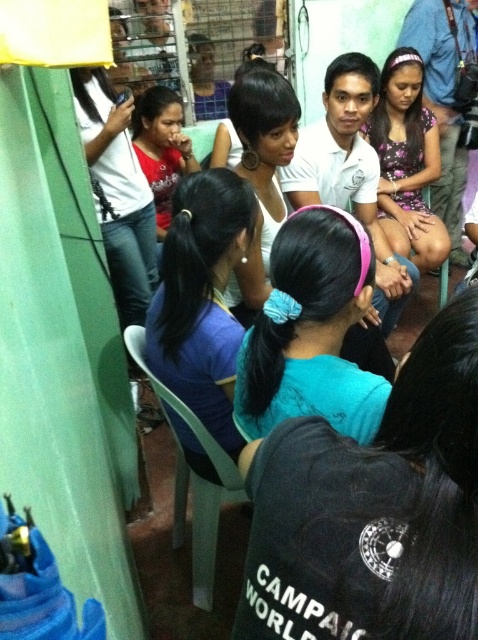
In the scene shown: Who is lower down, floral-patterned dress at center or white matte headband at center?

white matte headband at center is below.

Is floral-patterned dress at center further to the viewer compared to white matte headband at center?

Yes, it is behind white matte headband at center.

Identify the location of floral-patterned dress at center. (406, 161).

Does blue fabric shirt at center appear over white matte headband at center?

Actually, blue fabric shirt at center is below white matte headband at center.

Does blue fabric shirt at center appear on the left side of white matte headband at center?

Yes, blue fabric shirt at center is to the left of white matte headband at center.

Which is behind, point (208, 291) or point (232, 284)?

The point (232, 284) is more distant.

The image size is (478, 640). I want to click on blue fabric shirt at center, so click(x=202, y=298).

Which is more to the right, white cotton shirt at center or matte red shirt at center?

Positioned to the right is white cotton shirt at center.

Can you confirm if white cotton shirt at center is shorter than matte red shirt at center?

Incorrect, white cotton shirt at center's height does not fall short of matte red shirt at center's.

Does point (357, 212) lie behind point (147, 170)?

No, it is in front of (147, 170).

I want to click on white cotton shirt at center, so click(x=349, y=173).